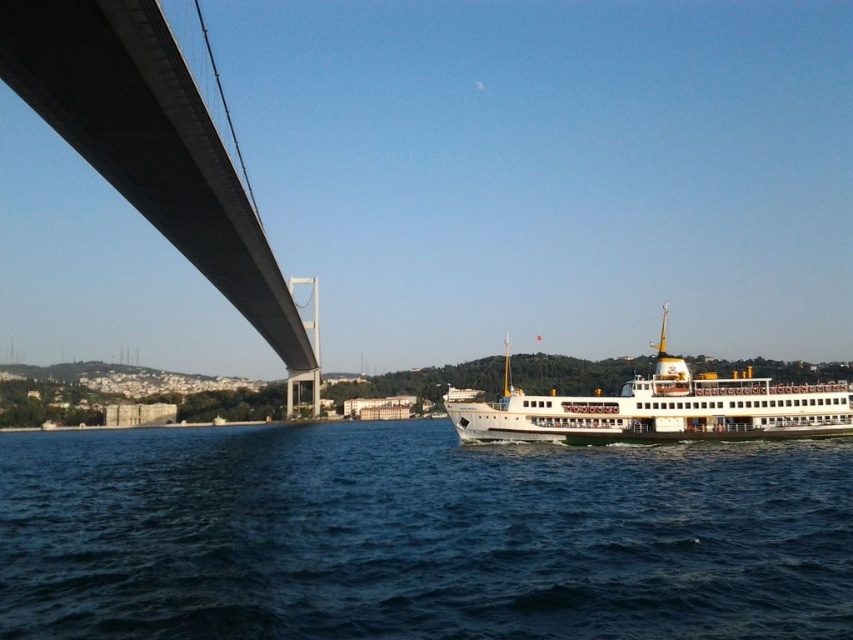
Question: Can you confirm if dark blue water at lower center is bigger than white glossy ferry at center?

Choices:
 (A) yes
 (B) no

Answer: (B)

Question: Can you confirm if gray concrete suspension bridge at upper left is thinner than white glossy ferry at center?

Choices:
 (A) yes
 (B) no

Answer: (A)

Question: Which of the following is the farthest from the observer?

Choices:
 (A) (0, 625)
 (B) (693, 419)

Answer: (B)

Question: Which of the following is the farthest from the observer?

Choices:
 (A) gray concrete suspension bridge at upper left
 (B) white glossy ferry at center
 (C) dark blue water at lower center

Answer: (B)

Question: Which of the following is the closest to the observer?

Choices:
 (A) (791, 483)
 (B) (102, 138)
 (C) (717, 422)

Answer: (A)

Question: Is gray concrete suspension bridge at upper left to the right of white glossy ferry at center from the viewer's perspective?

Choices:
 (A) no
 (B) yes

Answer: (A)